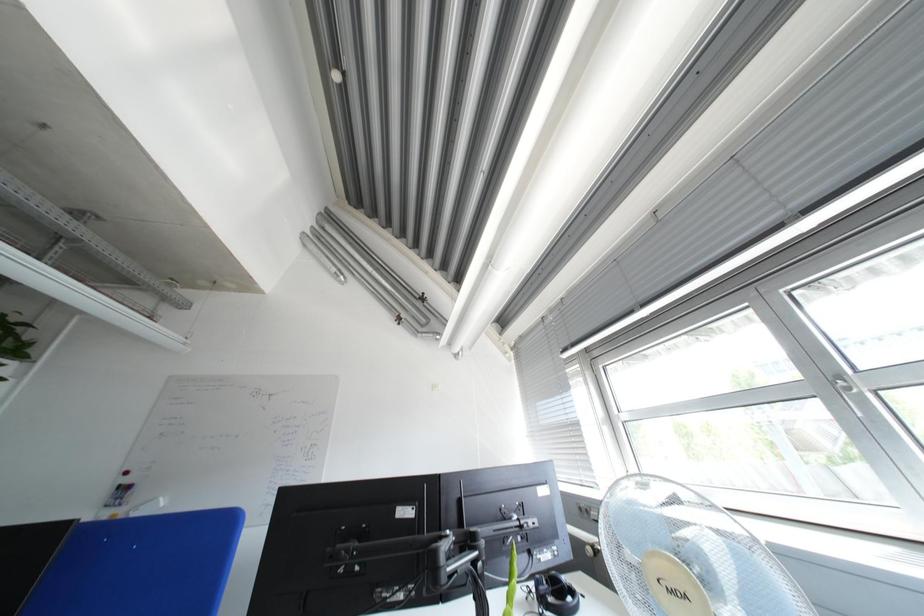
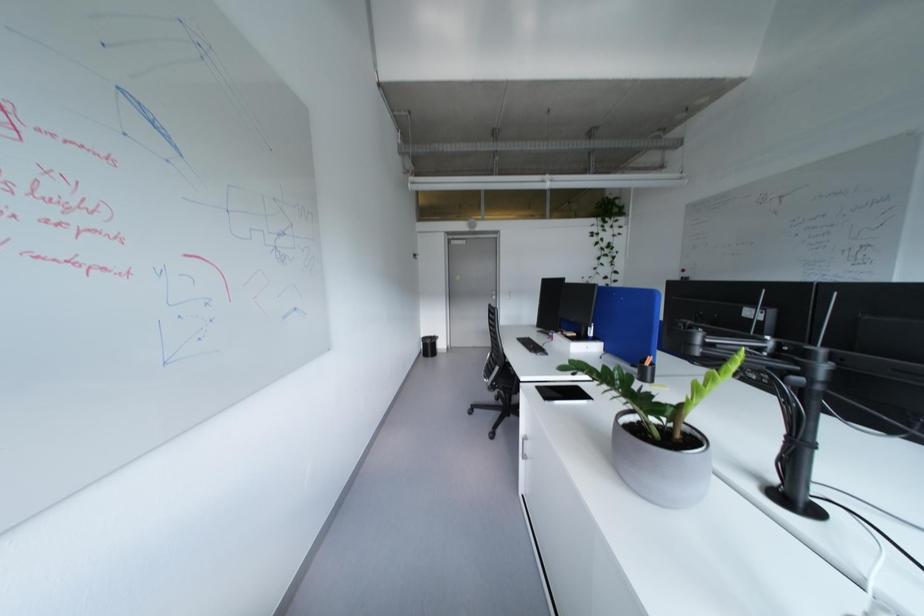
Question: The camera is either moving clockwise (left) or counter-clockwise (right) around the object. The first image is from the beginning of the video and the second image is from the end. Is the camera moving left or right when shooting the video?

Choices:
 (A) Left
 (B) Right

Answer: (B)